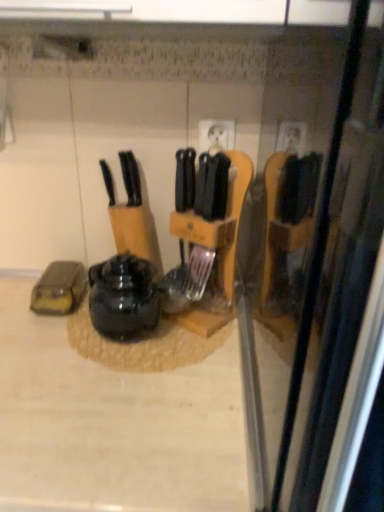
The height and width of the screenshot is (512, 384). Describe the element at coordinates (108, 181) in the screenshot. I see `black plastic knife at center` at that location.

The width and height of the screenshot is (384, 512). I want to click on black plastic knife at center, so click(x=108, y=181).

From a real-world perspective, between black plastic knife at center and shiny black kettle at center, who is vertically higher?

In real-world perspective, black plastic knife at center is above.

From the image's perspective, does black plastic knife at center appear higher than shiny black kettle at center?

Yes, from the image's perspective, black plastic knife at center is above shiny black kettle at center.

Between black plastic knife at center and shiny black kettle at center, which one has larger width?

shiny black kettle at center.

Can you confirm if black plastic knife at center is positioned to the left of shiny black kettle at center?

Indeed, black plastic knife at center is positioned on the left side of shiny black kettle at center.

Which is more to the right, beige laminate counter at center or shiny black kettle at center?

From the viewer's perspective, shiny black kettle at center appears more on the right side.

From a real-world perspective, does beige laminate counter at center stand above shiny black kettle at center?

Actually, beige laminate counter at center is physically below shiny black kettle at center in the real world.

What's the angular difference between beige laminate counter at center and shiny black kettle at center's facing directions?

1.87 degrees.

Is beige laminate counter at center inside or outside of shiny black kettle at center?

beige laminate counter at center exists outside the volume of shiny black kettle at center.

From a real-world perspective, is shiny black kettle at center positioned under beige laminate counter at center based on gravity?

No, from a real-world perspective, shiny black kettle at center is not beneath beige laminate counter at center.

Is shiny black kettle at center inside or outside of beige laminate counter at center?

shiny black kettle at center is not inside beige laminate counter at center, it's outside.

Considering the sizes of shiny black kettle at center and beige laminate counter at center in the image, is shiny black kettle at center taller or shorter than beige laminate counter at center?

Result: Clearly, shiny black kettle at center is shorter compared to beige laminate counter at center.

How many degrees apart are the facing directions of shiny black kettle at center and beige laminate counter at center?

The angular difference between shiny black kettle at center and beige laminate counter at center is 1.87 degrees.

How far apart are shiny black kettle at center and black plastic knife at center?

The distance of shiny black kettle at center from black plastic knife at center is 27.14 centimeters.

Considering the points (119, 277) and (111, 187), which point is behind, point (119, 277) or point (111, 187)?

The point (111, 187) is farther.

From a real-world perspective, is shiny black kettle at center above or below black plastic knife at center?

shiny black kettle at center is below black plastic knife at center.

Between black plastic knife at center and beige laminate counter at center, which one is positioned in front?

beige laminate counter at center is in front.

Are black plastic knife at center and beige laminate counter at center making contact?

No, black plastic knife at center is not making contact with beige laminate counter at center.

Does beige laminate counter at center appear on the right side of black plastic knife at center?

In fact, beige laminate counter at center is to the left of black plastic knife at center.

Does point (17, 467) appear closer or farther from the camera than point (107, 170)?

Clearly, point (17, 467) is closer to the camera than point (107, 170).

Considering the sizes of objects beige laminate counter at center and black plastic knife at center in the image provided, who is shorter, beige laminate counter at center or black plastic knife at center?

Standing shorter between the two is black plastic knife at center.

This screenshot has height=512, width=384. Find the location of `knife lying above the shiny black kettle at center (from the image's perspective)`. knife lying above the shiny black kettle at center (from the image's perspective) is located at coordinates (108, 181).

You are a GUI agent. You are given a task and a screenshot of the screen. Output one action in this format:
    pyautogui.click(x=<x>, y=<y>)
    Task: Click on the kitchen appliance that appears behind the beige laminate counter at center
    The width and height of the screenshot is (384, 512).
    Given the screenshot: What is the action you would take?
    pyautogui.click(x=123, y=297)

Looking at the image, which one is located further to beige laminate counter at center, shiny black kettle at center or black plastic knife at center?

black plastic knife at center is positioned further to the anchor beige laminate counter at center.

Based on their spatial positions, is beige laminate counter at center or black plastic knife at center closer to shiny black kettle at center?

beige laminate counter at center lies closer to shiny black kettle at center than the other object.

When comparing their distances from black plastic knife at center, does shiny black kettle at center or beige laminate counter at center seem further?

The object further to black plastic knife at center is beige laminate counter at center.

Based on their spatial positions, is black plastic knife at center or shiny black kettle at center closer to beige laminate counter at center?

shiny black kettle at center lies closer to beige laminate counter at center than the other object.

Based on their spatial positions, is beige laminate counter at center or shiny black kettle at center closer to black plastic knife at center?

shiny black kettle at center is closer to black plastic knife at center.

Looking at the image, which one is located closer to shiny black kettle at center, black plastic knife at center or beige laminate counter at center?

The object closer to shiny black kettle at center is beige laminate counter at center.

The width and height of the screenshot is (384, 512). In order to click on kitchen appliance between black plastic knife at center and beige laminate counter at center in the vertical direction in this screenshot , I will do `click(123, 297)`.